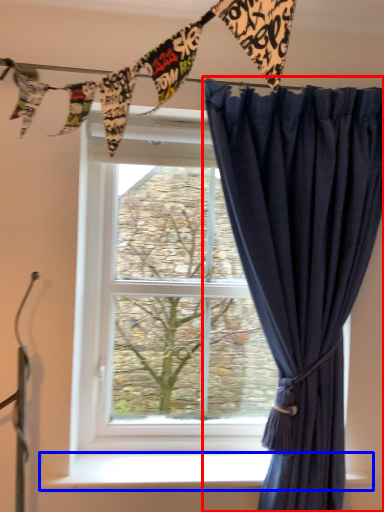
Question: Which object appears closest to the camera in this image, curtain (highlighted by a red box) or window sill (highlighted by a blue box)?

Choices:
 (A) curtain
 (B) window sill

Answer: (A)